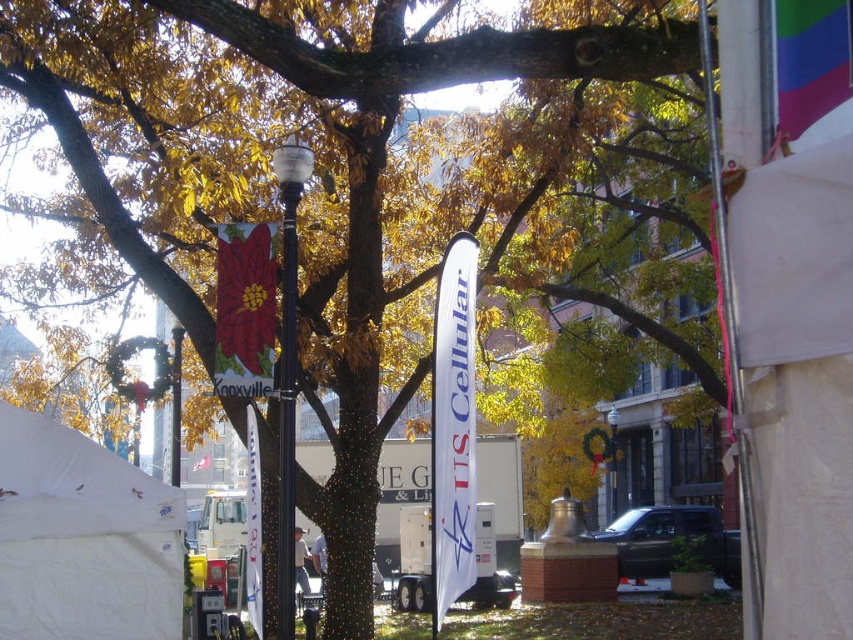
You are a city planner assessing the safety of public spaces. You notice the white fabric banner at center and the black polished pole at center. Given that the minimum safe distance between such structures is 10 meters to prevent collision during strong winds, is the current spacing compliant with safety regulations?

The distance between the white fabric banner at center and the black polished pole at center is 9.14 meters, which is less than the required 10 meters. Therefore, the current spacing does not comply with safety regulations.

You are standing in the autumn scene and want to touch both the metallic lamp post at center and the black polished pole at center. Which one should you reach for first?

You should reach for the metallic lamp post at center first because it is closer to you than the black polished pole at center.